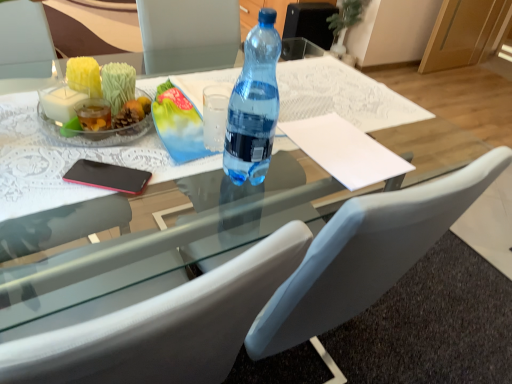
Question: From the image's perspective, is white paper at center under white leather chair at center?

Choices:
 (A) yes
 (B) no

Answer: (B)

Question: Considering the relative sizes of white paper at center and white leather chair at center in the image provided, is white paper at center shorter than white leather chair at center?

Choices:
 (A) yes
 (B) no

Answer: (A)

Question: From a real-world perspective, is white paper at center under white leather chair at center?

Choices:
 (A) no
 (B) yes

Answer: (A)

Question: Could you tell me if white paper at center is facing white leather chair at center?

Choices:
 (A) yes
 (B) no

Answer: (A)

Question: Is white paper at center not inside white leather chair at center?

Choices:
 (A) yes
 (B) no

Answer: (B)

Question: From a real-world perspective, is transparent plastic bottle at center above or below white paper at center?

Choices:
 (A) above
 (B) below

Answer: (A)

Question: Does point (236, 112) appear closer or farther from the camera than point (367, 162)?

Choices:
 (A) farther
 (B) closer

Answer: (B)

Question: Considering the positions of transparent plastic bottle at center and white paper at center in the image, is transparent plastic bottle at center wider or thinner than white paper at center?

Choices:
 (A) thin
 (B) wide

Answer: (A)

Question: Is transparent plastic bottle at center inside or outside of white paper at center?

Choices:
 (A) outside
 (B) inside

Answer: (A)

Question: In terms of width, does white leather chair at center look wider or thinner when compared to transparent plastic bottle at center?

Choices:
 (A) thin
 (B) wide

Answer: (B)

Question: Is white leather chair at center taller or shorter than transparent plastic bottle at center?

Choices:
 (A) tall
 (B) short

Answer: (A)

Question: From the image's perspective, is white leather chair at center located above or below transparent plastic bottle at center?

Choices:
 (A) below
 (B) above

Answer: (A)

Question: In the image, is white leather chair at center positioned in front of or behind transparent plastic bottle at center?

Choices:
 (A) behind
 (B) front

Answer: (B)

Question: In the image, is white leather chair at center positioned in front of or behind transparent glass table at center?

Choices:
 (A) behind
 (B) front

Answer: (B)

Question: From a real-world perspective, is white leather chair at center positioned above or below transparent glass table at center?

Choices:
 (A) above
 (B) below

Answer: (B)